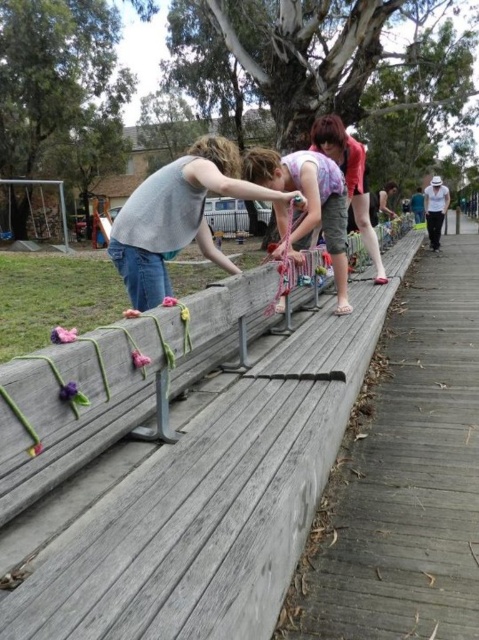
You are a photographer standing on the wooden walkway. You notice two people wearing the matte gray tank top at center and the pastel floral dress at center. Which clothing item is higher up in the image?

The matte gray tank top at center is above the pastel floral dress at center in the image.

You are a photographer trying to capture a closeup of the light pink fabric at center while avoiding the matte gray tank top at center in the shot. Which object should you position the camera below to ensure the tank top is out of frame?

To avoid the matte gray tank top at center, position the camera below the light pink fabric at center since the matte gray tank top at center is above it.

Where is the pastel floral dress at center located in the image?

The pastel floral dress at center is located at the 2D coordinate point of [308,202].